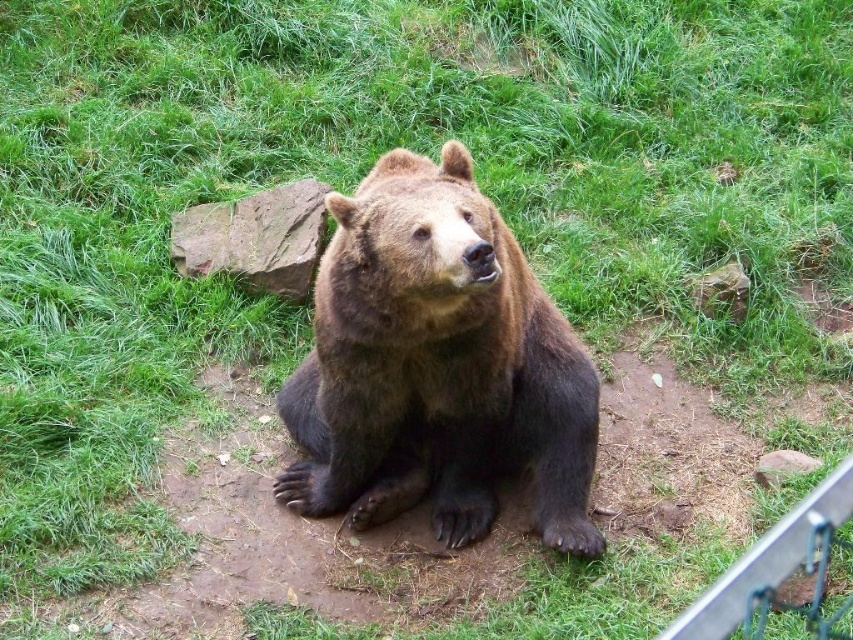
Is point (364, 284) more distant than point (701, 312)?

That is False.

Which of these two, brown furry bear at center or brown rough rock at center-right, stands taller?

With more height is brown furry bear at center.

Measure the distance between brown furry bear at center and camera.

brown furry bear at center and camera are 2.39 meters apart.

In order to click on brown furry bear at center in this screenshot , I will do `click(437, 365)`.

Is brown furry bear at center shorter than brown rock at center?

No, brown furry bear at center is not shorter than brown rock at center.

Locate an element on the screen. This screenshot has height=640, width=853. brown furry bear at center is located at coordinates (437, 365).

Consider the image. Does brown rough rock at center appear on the left side of brown rock at center?

Indeed, brown rough rock at center is positioned on the left side of brown rock at center.

Does brown rough rock at center appear on the right side of brown rock at center?

In fact, brown rough rock at center is to the left of brown rock at center.

Between point (312, 234) and point (757, 468), which one is positioned behind?

The point (312, 234) is more distant.

At what (x,y) coordinates should I click in order to perform the action: click on brown rough rock at center. Please return your answer as a coordinate pair (x, y). Looking at the image, I should click on (254, 237).